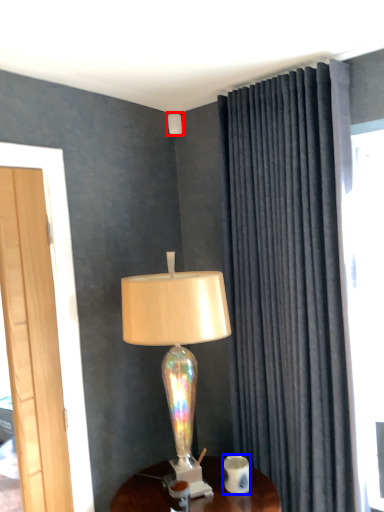
Question: Which of the following is the farthest to the observer, lamp (highlighted by a red box) or coffee cup (highlighted by a blue box)?

Choices:
 (A) lamp
 (B) coffee cup

Answer: (A)